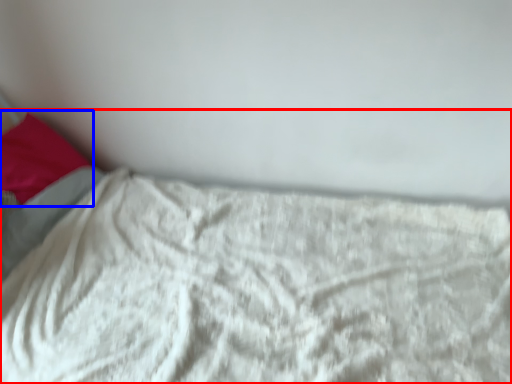
Question: Which of the following is the closest to the observer, bed (highlighted by a red box) or pillow (highlighted by a blue box)?

Choices:
 (A) bed
 (B) pillow

Answer: (A)